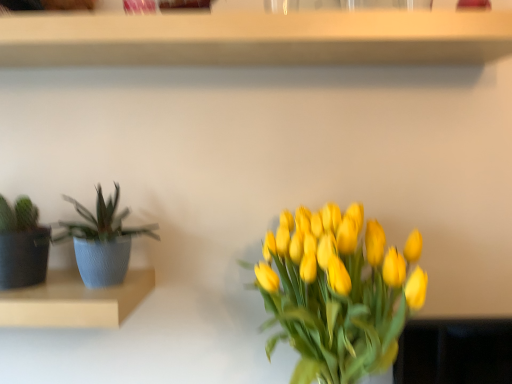
Question: Does blue textured pot at left have a lesser height compared to matte blue pot at left, placed as the 2th shelf when sorted from top to bottom?

Choices:
 (A) no
 (B) yes

Answer: (A)

Question: Considering the relative sizes of blue textured pot at left and matte blue pot at left, which ranks as the 1th shelf in bottom-to-top order, in the image provided, is blue textured pot at left thinner than matte blue pot at left, which ranks as the 1th shelf in bottom-to-top order,?

Choices:
 (A) yes
 (B) no

Answer: (A)

Question: Is blue textured pot at left further to camera compared to matte blue pot at left, placed as the 2th shelf when sorted from top to bottom?

Choices:
 (A) no
 (B) yes

Answer: (B)

Question: From a real-world perspective, is blue textured pot at left under matte blue pot at left, placed as the 2th shelf when sorted from top to bottom?

Choices:
 (A) no
 (B) yes

Answer: (A)

Question: Is blue textured pot at left closer to the viewer compared to matte blue pot at left, placed as the 2th shelf when sorted from top to bottom?

Choices:
 (A) no
 (B) yes

Answer: (A)

Question: Is blue textured pot at left located outside matte blue pot at left, which ranks as the 1th shelf in bottom-to-top order?

Choices:
 (A) yes
 (B) no

Answer: (A)

Question: Considering the relative sizes of matte blue pot at left, placed as the 2th shelf when sorted from top to bottom, and blue textured pot at left in the image provided, is matte blue pot at left, placed as the 2th shelf when sorted from top to bottom, wider than blue textured pot at left?

Choices:
 (A) yes
 (B) no

Answer: (A)

Question: From the image's perspective, is matte blue pot at left, placed as the 2th shelf when sorted from top to bottom, on top of blue textured pot at left?

Choices:
 (A) no
 (B) yes

Answer: (A)

Question: Can you confirm if matte blue pot at left, which ranks as the 1th shelf in bottom-to-top order, is positioned to the left of blue textured pot at left?

Choices:
 (A) no
 (B) yes

Answer: (B)

Question: Is matte blue pot at left, placed as the 2th shelf when sorted from top to bottom, positioned in front of blue textured pot at left?

Choices:
 (A) yes
 (B) no

Answer: (A)

Question: From a real-world perspective, is matte blue pot at left, which ranks as the 1th shelf in bottom-to-top order, physically below blue textured pot at left?

Choices:
 (A) no
 (B) yes

Answer: (B)

Question: Can we say matte blue pot at left, which ranks as the 1th shelf in bottom-to-top order, lies outside blue textured pot at left?

Choices:
 (A) yes
 (B) no

Answer: (A)

Question: Is blue textured pot at left positioned with its back to wooden shelf at upper center, positioned as the second shelf in bottom-to-top order?

Choices:
 (A) yes
 (B) no

Answer: (B)